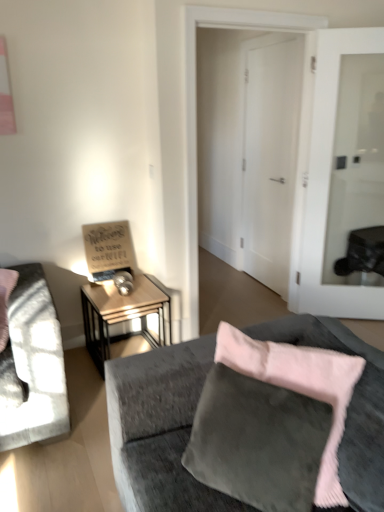
Where is `free point in front of metallic silver table lamp at left`? free point in front of metallic silver table lamp at left is located at coordinates (x=116, y=300).